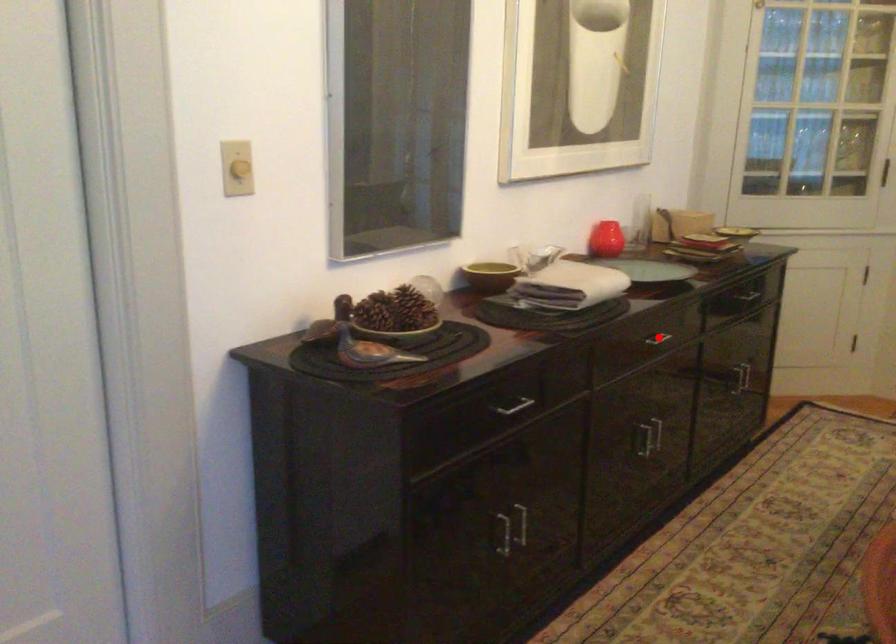
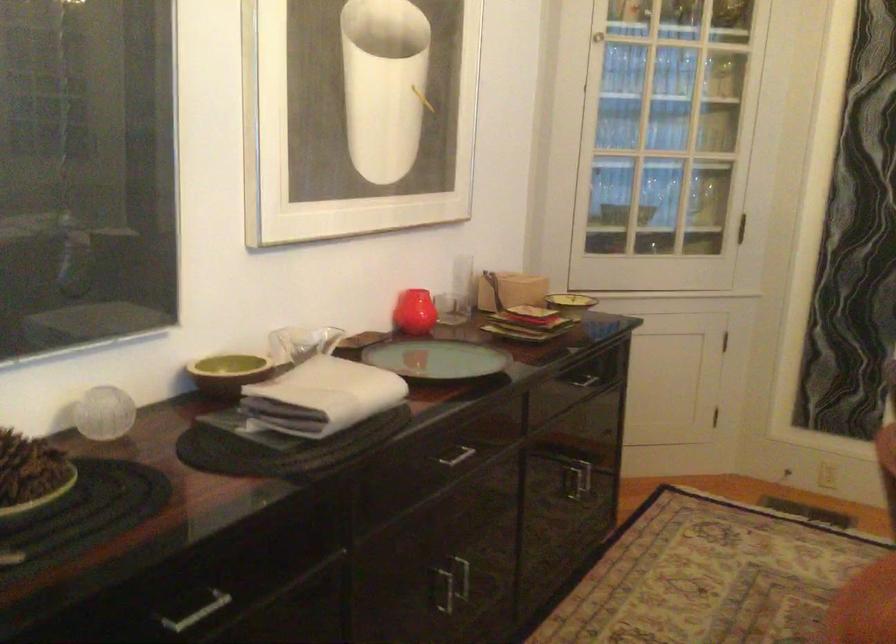
Question: A red point is marked in image1. In image2, is the corresponding 3D point closer to the camera or farther? Reply with the corresponding letter.

Choices:
 (A) The corresponding 3D point is closer.
 (B) The corresponding 3D point is farther.

Answer: (A)